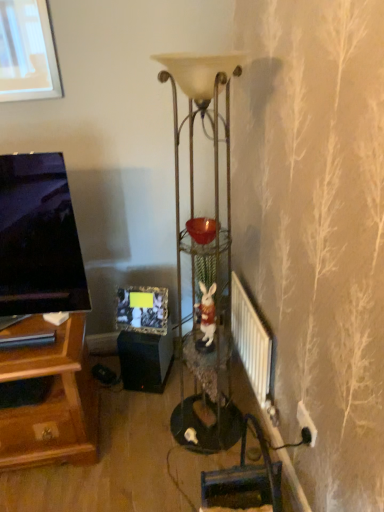
Where is `vacant space in front of metallic gold floor lamp at center`? This screenshot has height=512, width=384. vacant space in front of metallic gold floor lamp at center is located at coordinates (180, 477).